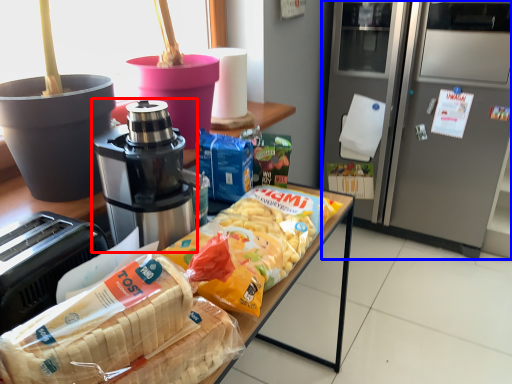
Question: Which object appears closest to the camera in this image, coffee maker (highlighted by a red box) or home appliance (highlighted by a blue box)?

Choices:
 (A) coffee maker
 (B) home appliance

Answer: (A)